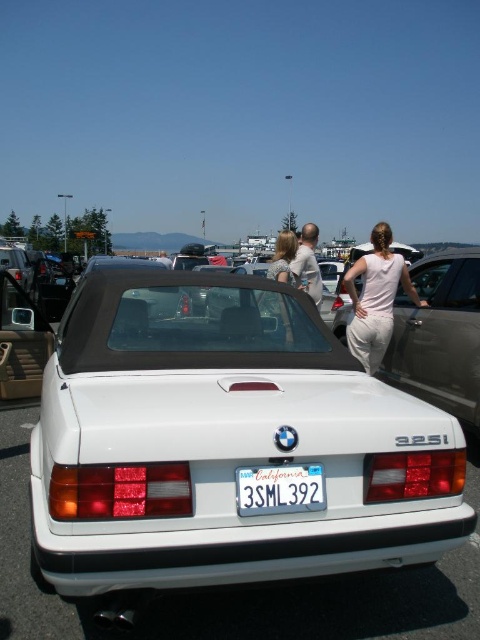
Question: Does matte beige dress at center have a larger size compared to light beige fabric shirt at center?

Choices:
 (A) yes
 (B) no

Answer: (A)

Question: Which object appears farthest from the camera in this image?

Choices:
 (A) white glossy sedan at center
 (B) white cotton shirt at center
 (C) matte beige dress at center
 (D) white plastic license plate at center

Answer: (A)

Question: Does white glossy sedan at center appear on the right side of white plastic license plate at center?

Choices:
 (A) yes
 (B) no

Answer: (A)

Question: Which object appears farthest from the camera in this image?

Choices:
 (A) white plastic license plate at center
 (B) matte beige dress at center
 (C) white glossy sedan at center

Answer: (C)

Question: Is white glossy sedan at center bigger than light beige fabric shirt at center?

Choices:
 (A) yes
 (B) no

Answer: (B)

Question: Which point appears closest to the camera in this image?

Choices:
 (A) (285, 304)
 (B) (194, 579)

Answer: (B)